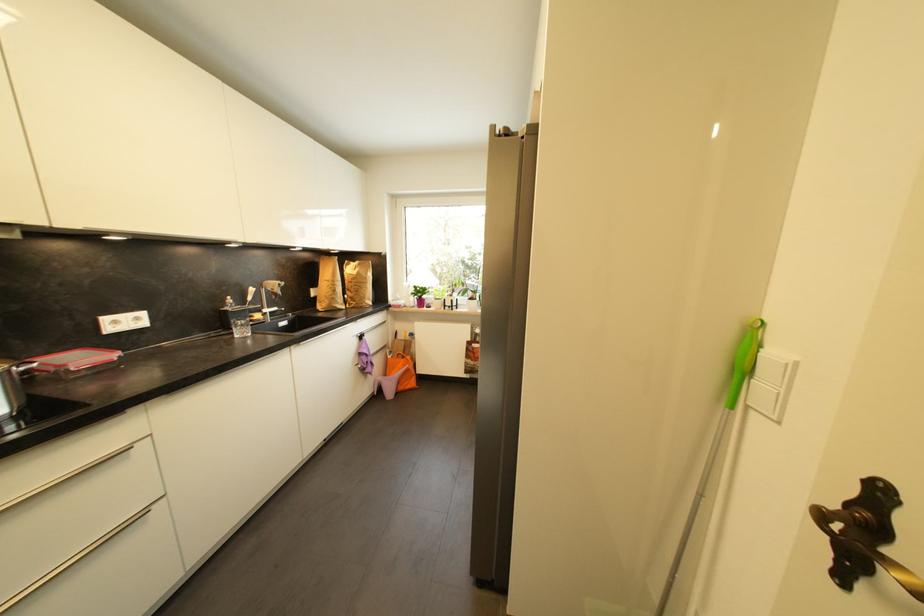
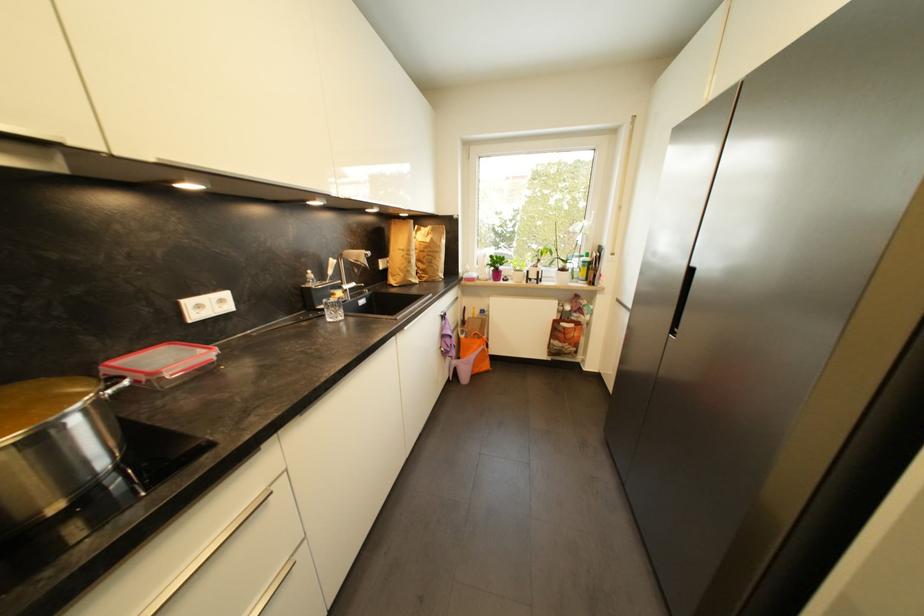
Where in the second image is the point corresponding to point (395, 359) from the first image?

(468, 339)